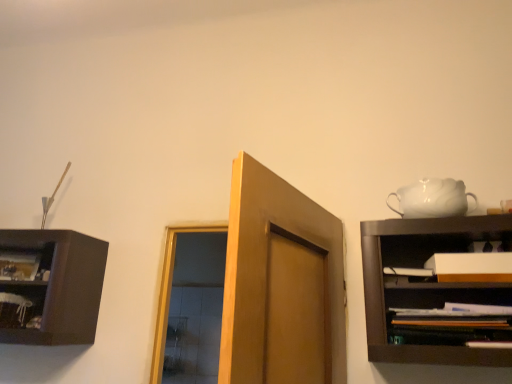
Question: Is the position of white matte cabinet at right more distant than that of wooden shelf at left, acting as the 1th shelf starting from the back?

Choices:
 (A) yes
 (B) no

Answer: (B)

Question: From the image's perspective, would you say white matte cabinet at right is positioned over wooden shelf at left, which is the second shelf in front-to-back order?

Choices:
 (A) yes
 (B) no

Answer: (A)

Question: Is white matte cabinet at right not close to wooden shelf at left, acting as the 1th shelf starting from the back?

Choices:
 (A) no
 (B) yes

Answer: (B)

Question: From a real-world perspective, does white matte cabinet at right sit lower than wooden shelf at left, which is the second shelf in front-to-back order?

Choices:
 (A) no
 (B) yes

Answer: (A)

Question: Is white matte cabinet at right surrounding wooden shelf at left, which is the second shelf in front-to-back order?

Choices:
 (A) no
 (B) yes

Answer: (A)

Question: Visually, is wooden shelf at left, which is the second shelf in front-to-back order, positioned to the left or to the right of white matte cabinet at right?

Choices:
 (A) left
 (B) right

Answer: (A)

Question: Is point (42, 286) positioned closer to the camera than point (440, 236)?

Choices:
 (A) closer
 (B) farther

Answer: (B)

Question: Is wooden shelf at left, the 1th shelf from the left, taller or shorter than white matte cabinet at right?

Choices:
 (A) short
 (B) tall

Answer: (B)

Question: Looking at their shapes, would you say wooden shelf at left, which is the second shelf in front-to-back order, is wider or thinner than white matte cabinet at right?

Choices:
 (A) wide
 (B) thin

Answer: (A)

Question: In the image, is white glossy teapot at upper right positioned in front of or behind wooden shelf at right, which is the 2th shelf from left to right?

Choices:
 (A) front
 (B) behind

Answer: (B)

Question: Considering the relative positions of white glossy teapot at upper right and wooden shelf at right, which is the 1th shelf in right-to-left order, in the image provided, is white glossy teapot at upper right to the left or to the right of wooden shelf at right, which is the 1th shelf in right-to-left order,?

Choices:
 (A) left
 (B) right

Answer: (A)

Question: Is white glossy teapot at upper right bigger or smaller than wooden shelf at right, which is the 2th shelf from left to right?

Choices:
 (A) small
 (B) big

Answer: (A)

Question: Is white glossy teapot at upper right inside or outside of wooden shelf at right, the 1th shelf viewed from the front?

Choices:
 (A) inside
 (B) outside

Answer: (B)

Question: From a real-world perspective, is wooden shelf at right, placed as the second shelf when sorted from back to front, physically located above or below wooden shelf at left, which is the 2th shelf from right to left?

Choices:
 (A) above
 (B) below

Answer: (B)

Question: From the image's perspective, is wooden shelf at right, which is the 2th shelf from left to right, positioned above or below wooden shelf at left, the 1th shelf from the left?

Choices:
 (A) above
 (B) below

Answer: (A)